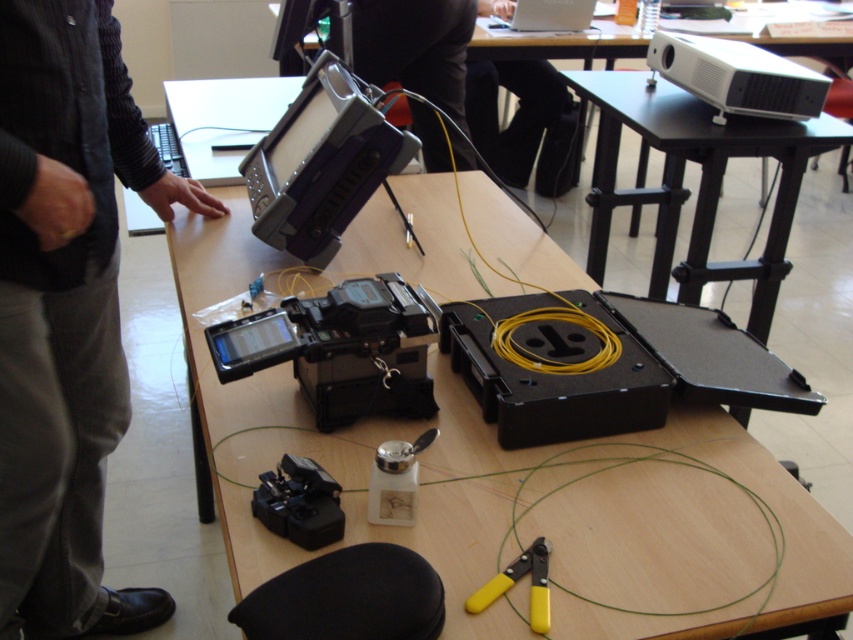
You are a technician standing in front of the workspace. You need to place a tool on the nearest object. Which object should you choose between the black plastic table at upper center and the black plastic video camera at center?

The black plastic table at upper center is closer to you than the black plastic video camera at center, so you should place the tool on the black plastic table at upper center.

From the picture: You are a technician in the scene and need to access the purple plastic video camera at center. However, your dark gray pants at left are blocking the camera. Can you move the pants to reach the camera?

The dark gray pants at left is positioned under the purple plastic video camera at center, so you can move the pants to access the camera.

You are setting up a video call and need to place the purple plastic video camera at center on the wooden table at center. Based on their sizes, will the camera fit entirely on the table?

The wooden table at center has a larger width than the purple plastic video camera at center, so the camera will fit entirely on the table.